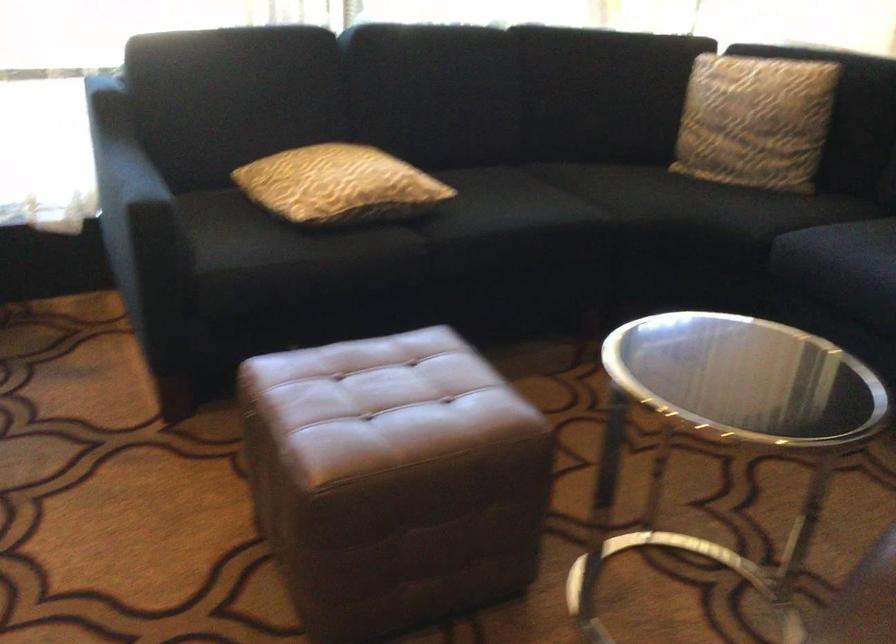
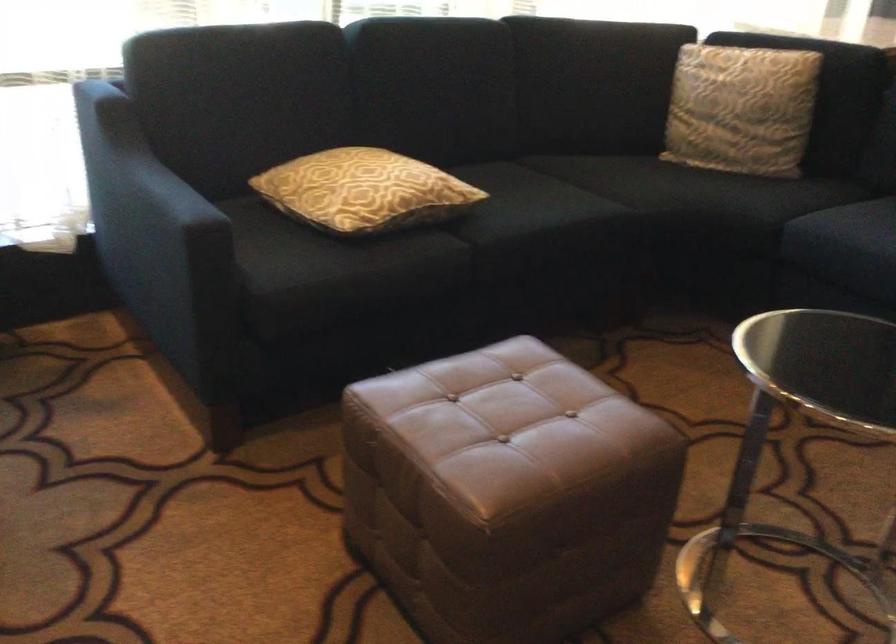
Question: In a continuous first-person perspective shot, in which direction is the camera moving?

Choices:
 (A) Left
 (B) Right
 (C) Forward
 (D) Backward

Answer: (A)